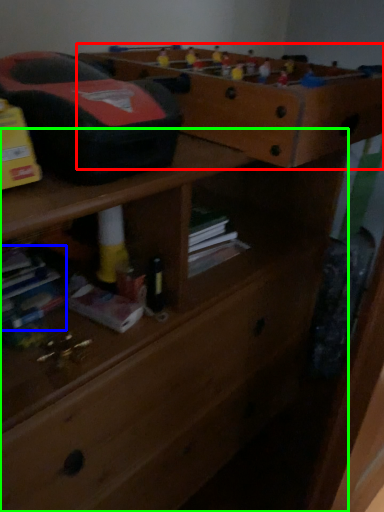
Question: Which object is positioned farthest from shelf (highlighted by a red box)? Select from book (highlighted by a blue box) and chest of drawers (highlighted by a green box).

Choices:
 (A) book
 (B) chest of drawers

Answer: (A)